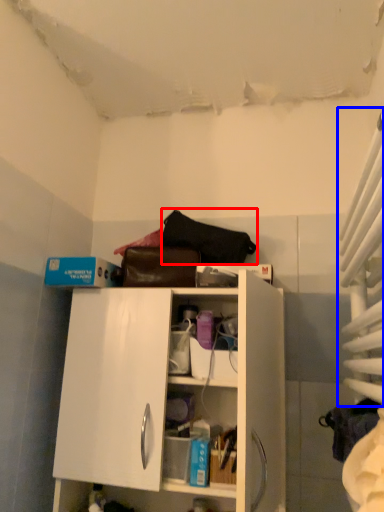
Question: Among these objects, which one is farthest to the camera, handbag (highlighted by a red box) or curtain (highlighted by a blue box)?

Choices:
 (A) handbag
 (B) curtain

Answer: (A)